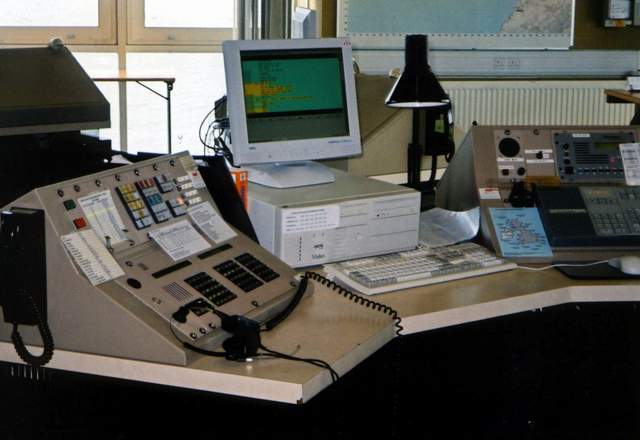
Identify the location of keyboard. (379, 262).